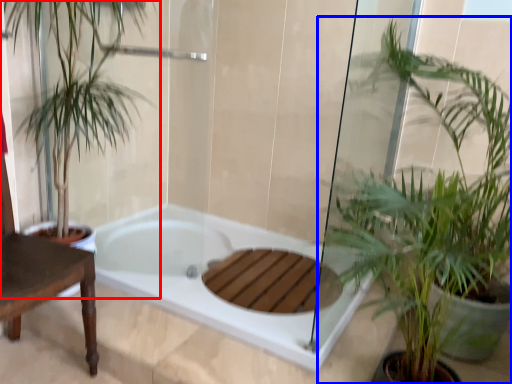
Question: Which point is closer to the camera, houseplant (highlighted by a red box) or houseplant (highlighted by a blue box)?

Choices:
 (A) houseplant
 (B) houseplant

Answer: (B)